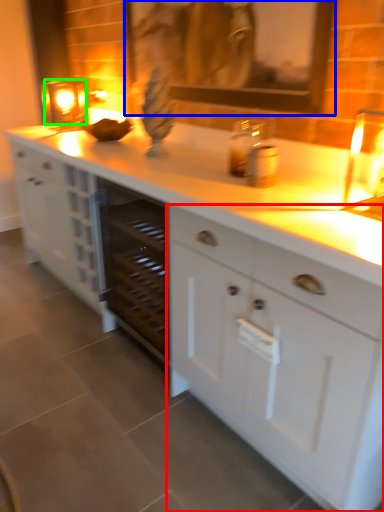
Question: Which object is positioned closest to cabinetry (highlighted by a red box)? Select from picture frame (highlighted by a blue box) and candle holder (highlighted by a green box).

Choices:
 (A) picture frame
 (B) candle holder

Answer: (A)